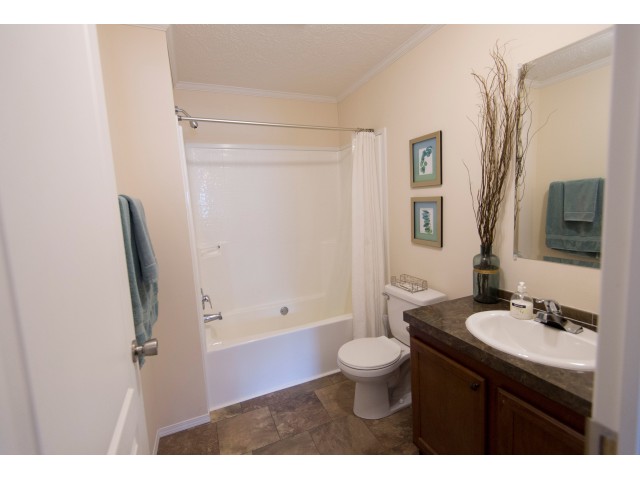
The image size is (640, 480). What are the coordinates of `floor` in the screenshot? It's located at (307, 424).